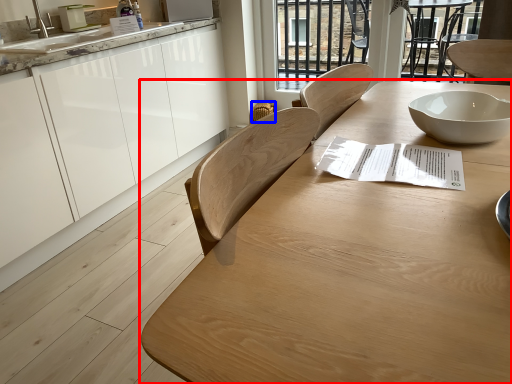
Question: Which object is further to the camera taking this photo, table (highlighted by a red box) or chair (highlighted by a blue box)?

Choices:
 (A) table
 (B) chair

Answer: (B)